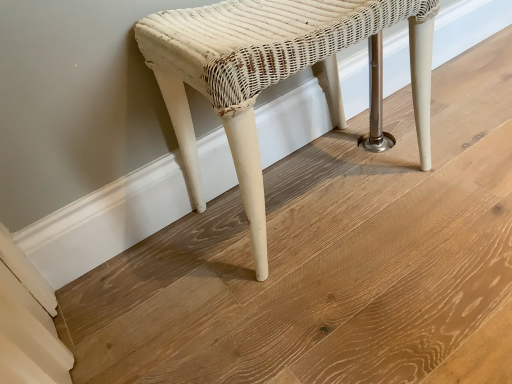
Find the location of `vacant space that is to the left of white wicker stool at center`. vacant space that is to the left of white wicker stool at center is located at coordinates (164, 276).